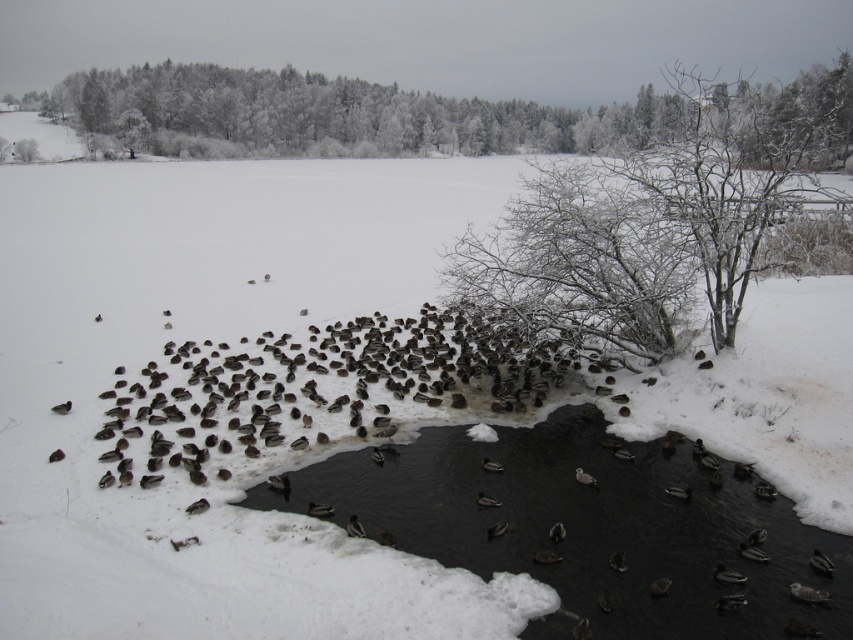
You are an observer standing at the edge of the frozen lake. You notice the black ice stream at lower center and the white frosty tree at upper center. Based on their positions, which object is located to the east of the other?

The black ice stream at lower center is to the right of the white frosty tree at upper center. Since the observer is facing the lake, right would correspond to the east direction. Therefore, the black ice stream at lower center is located to the east of the white frosty tree at upper center.

You are a winter explorer standing at the edge of the frozen lake. You see the black ice stream at lower center. Where exactly is the black ice stream located in terms of coordinates?

The black ice stream at lower center is located at coordinates point (x=589, y=528).